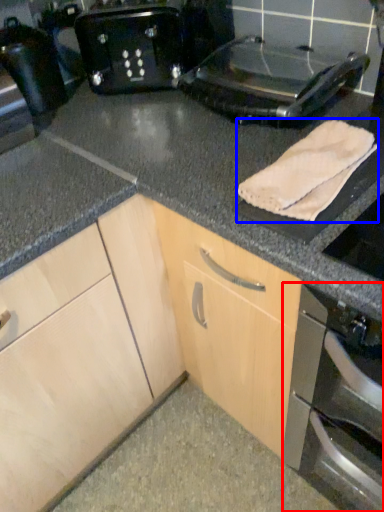
Question: Which object is further to the camera taking this photo, home appliance (highlighted by a red box) or bath towel (highlighted by a blue box)?

Choices:
 (A) home appliance
 (B) bath towel

Answer: (B)